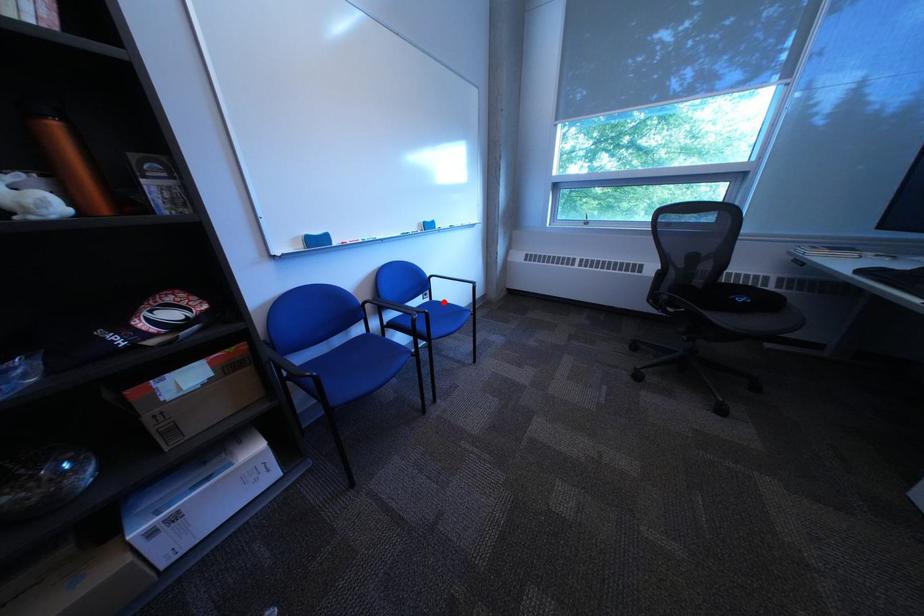
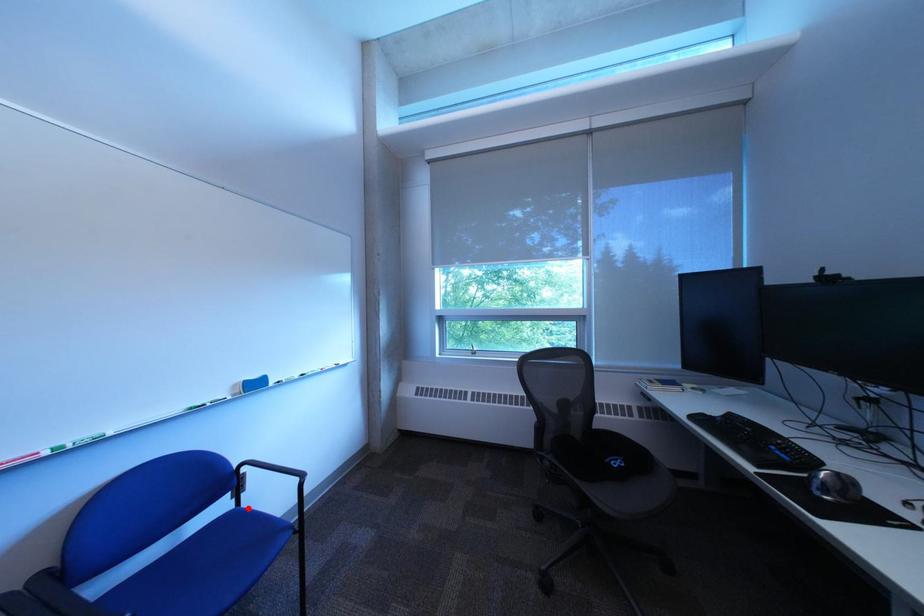
I am providing you with two images of the same scene from different viewpoints. A red point is marked on the first image and another point is marked on the second image. Is the marked point in image1 the same physical position as the marked point in image2?

Yes